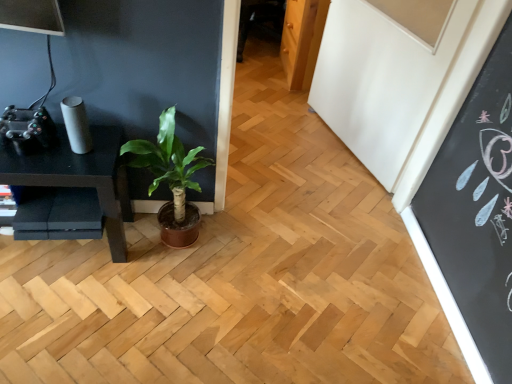
Question: Relative to black matte table at left, is green leafy plant at center in front or behind?

Choices:
 (A) front
 (B) behind

Answer: (A)

Question: Considering the positions of green leafy plant at center and black matte table at left in the image, is green leafy plant at center bigger or smaller than black matte table at left?

Choices:
 (A) big
 (B) small

Answer: (B)

Question: Does point (193, 148) appear closer or farther from the camera than point (88, 162)?

Choices:
 (A) closer
 (B) farther

Answer: (B)

Question: From the image's perspective, relative to green leafy plant at center, is black matte table at left above or below?

Choices:
 (A) below
 (B) above

Answer: (A)

Question: Is point (119, 188) positioned closer to the camera than point (157, 148)?

Choices:
 (A) closer
 (B) farther

Answer: (B)

Question: Is black matte table at left taller or shorter than green leafy plant at center?

Choices:
 (A) tall
 (B) short

Answer: (B)

Question: Choose the correct answer: Is black matte table at left inside green leafy plant at center or outside it?

Choices:
 (A) inside
 (B) outside

Answer: (B)